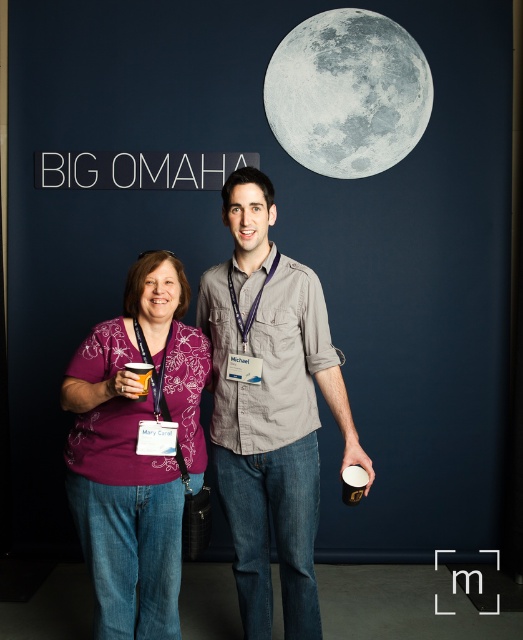
You are a photographer trying to capture a clear shot of the gray textured moon at upper right and the white glossy cup at lower center. However, the cup is partially blocking the moon in your current frame. How can you adjust your position to ensure both are visible without obstruction?

Move your camera position so that the white glossy cup at lower center is no longer behind the gray textured moon at upper right. Since the white glossy cup at lower center is behind the gray textured moon at upper right, moving the camera angle slightly downward or to the side would allow both objects to be visible without obstruction.

You are taking a photo of two points in the image. The first point is at coordinate point (103, 499) and the second point is at coordinate point (144, 385). Which point is closer to the camera?

Point (103, 499) is further to the camera than point (144, 385), so the second point is closer to the camera.

You are organizing a costume party and need to arrange props based on their sizes. You have a gray cotton shirt at center and an orange paper cup at lower left. Which prop should you place on the higher shelf to ensure proper stacking?

The gray cotton shirt at center has a greater height compared to the orange paper cup at lower left, so it should be placed on the higher shelf to ensure proper stacking.